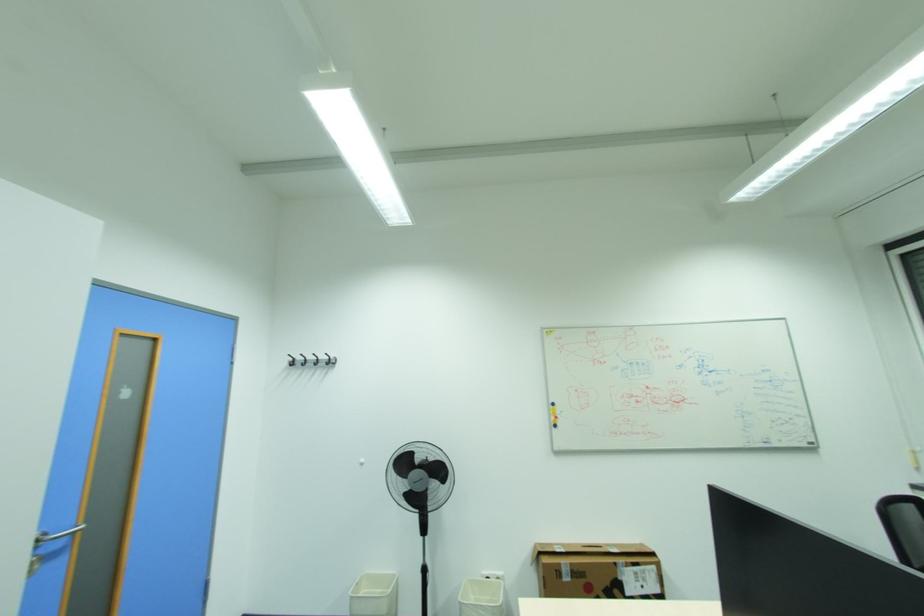
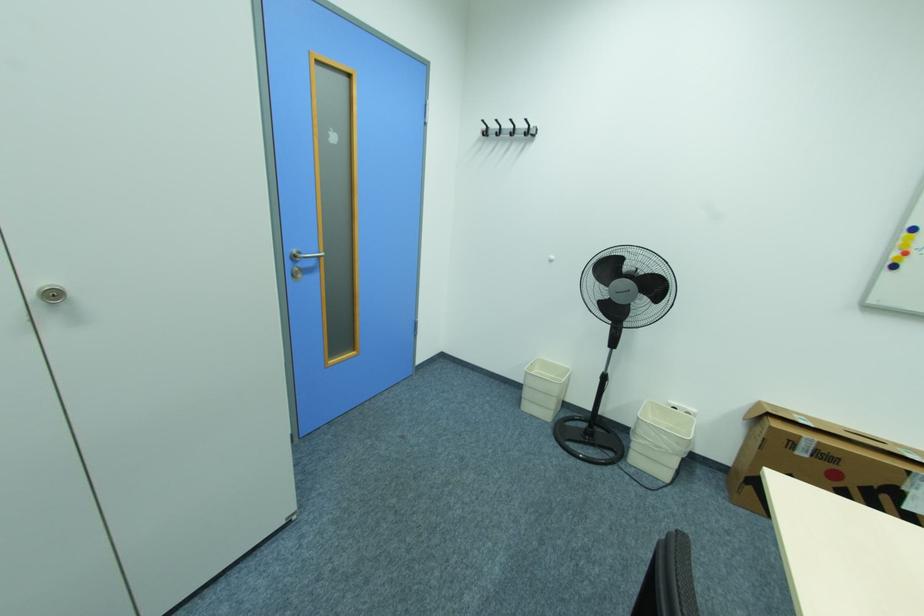
In the second image, find the point that corresponds to (298,363) in the first image.

(492, 132)